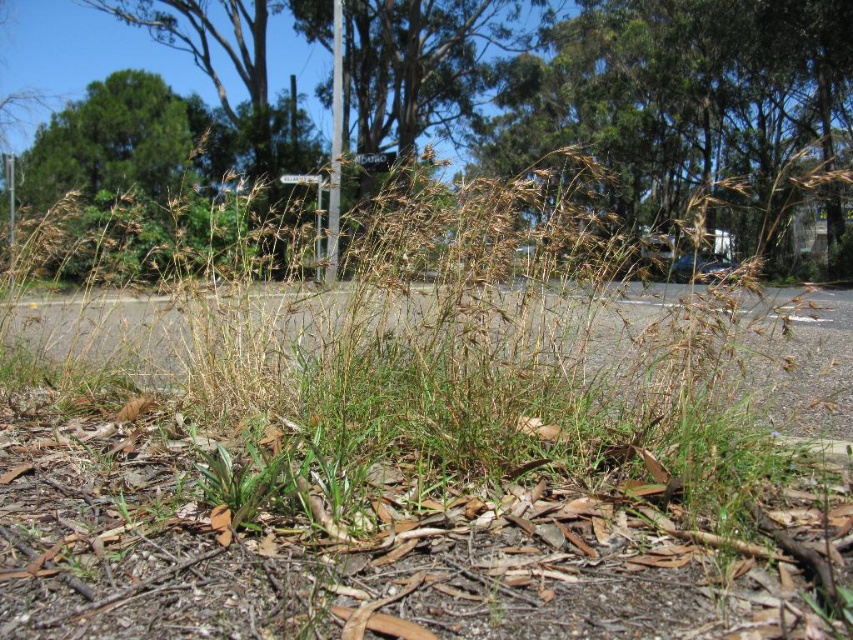
Question: Is green leafy tree at upper center thinner than metallic pole at center?

Choices:
 (A) yes
 (B) no

Answer: (B)

Question: Does brown grass at upper center lie behind white plastic sign at center?

Choices:
 (A) no
 (B) yes

Answer: (A)

Question: Which point is farther to the camera?

Choices:
 (A) (544, 38)
 (B) (741, 65)
 (C) (291, 180)
 (D) (355, 163)

Answer: (A)

Question: Among these objects, which one is nearest to the camera?

Choices:
 (A) metallic pole at center
 (B) metallic silver street sign at upper center

Answer: (A)

Question: From the image, what is the correct spatial relationship of metallic pole at center in relation to metallic silver street sign at upper center?

Choices:
 (A) left
 (B) right

Answer: (A)

Question: Which object appears farthest from the camera in this image?

Choices:
 (A) metallic silver street sign at upper center
 (B) brown grass at upper center
 (C) white plastic sign at center
 (D) metallic pole at center

Answer: (A)